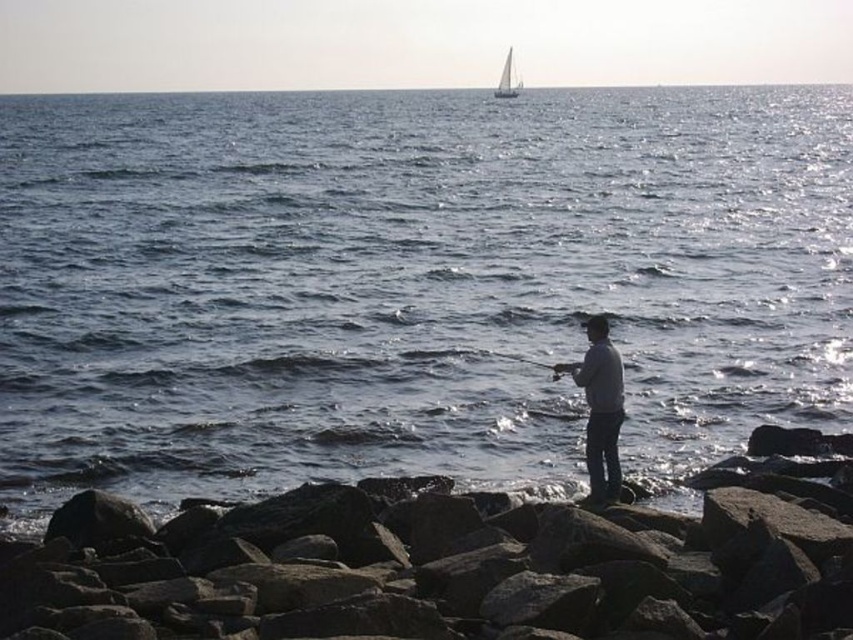
Question: Is blue water at center above smooth black rod at center?

Choices:
 (A) no
 (B) yes

Answer: (B)

Question: Which is nearer to the blue water at center?

Choices:
 (A) rough textured rocks at lower center
 (B) smooth black rod at center
 (C) gray cotton shirt at center
 (D) white sailboat at upper center

Answer: (D)

Question: Which of these objects is positioned closest to the smooth black rod at center?

Choices:
 (A) white sailboat at upper center
 (B) blue water at center
 (C) rough textured rocks at lower center
 (D) gray cotton shirt at center

Answer: (D)

Question: Which point appears closest to the camera in this image?

Choices:
 (A) (508, 97)
 (B) (541, 300)
 (C) (422, 573)

Answer: (C)

Question: Is blue water at center below smooth black rod at center?

Choices:
 (A) no
 (B) yes

Answer: (A)

Question: Can you confirm if blue water at center is positioned above gray cotton shirt at center?

Choices:
 (A) yes
 (B) no

Answer: (A)